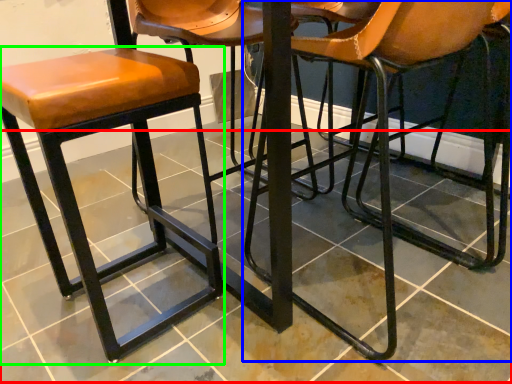
Question: Based on their relative distances, which object is nearer to tile (highlighted by a red box)? Choose from chair (highlighted by a blue box) and stool (highlighted by a green box).

Choices:
 (A) chair
 (B) stool

Answer: (B)